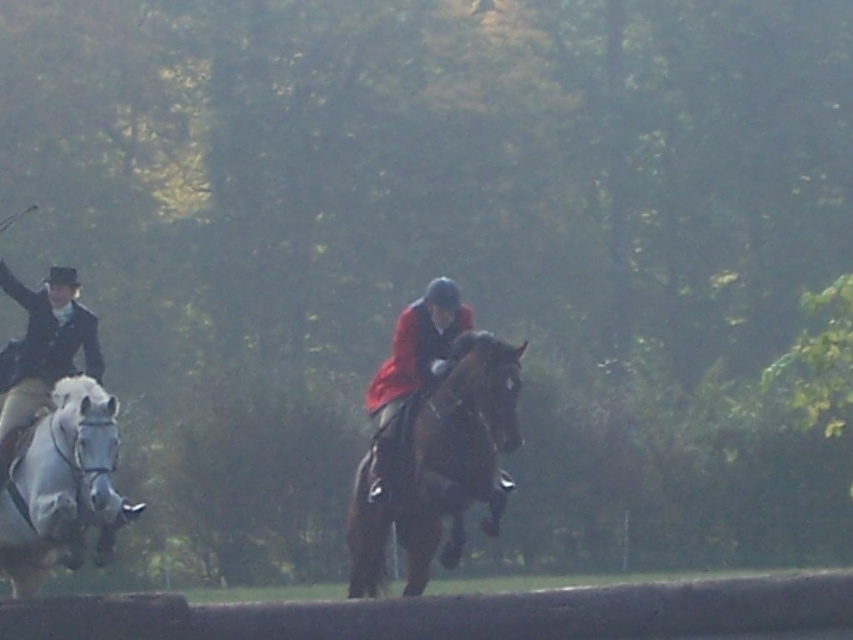
You are an equestrian judge observing the shiny brown horse at center and the white glossy horse at left. Which horse has a smaller body width?

The shiny brown horse at center has a smaller body width than the white glossy horse at left.

You are a photographer positioned to the left of the scene. You want to capture a photo where the white glossy horse at left is visible above the red velvet jacket at center. Is this possible given their current positions?

The white glossy horse at left is currently below the red velvet jacket at center, so it would not be possible to capture them above in this position without adjusting their positions.